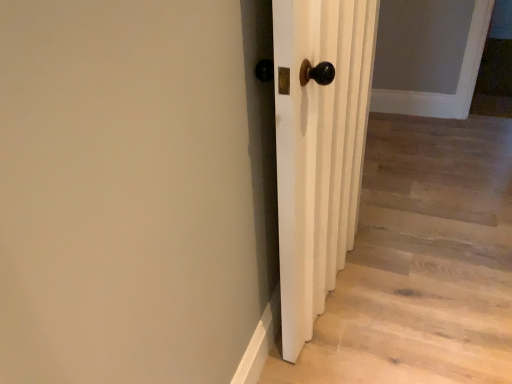
Question: Is point (349, 41) positioned closer to the camera than point (396, 334)?

Choices:
 (A) closer
 (B) farther

Answer: (A)

Question: From a real-world perspective, is white wooden door at center positioned above or below white matte door at center?

Choices:
 (A) below
 (B) above

Answer: (B)

Question: Would you say white wooden door at center is inside or outside white matte door at center?

Choices:
 (A) inside
 (B) outside

Answer: (B)

Question: Looking at the image, does white matte door at center seem bigger or smaller compared to white wooden door at center?

Choices:
 (A) small
 (B) big

Answer: (A)

Question: Choose the correct answer: Is white matte door at center inside white wooden door at center or outside it?

Choices:
 (A) outside
 (B) inside

Answer: (A)

Question: From a real-world perspective, relative to white wooden door at center, is white matte door at center vertically above or below?

Choices:
 (A) below
 (B) above

Answer: (A)

Question: From the image's perspective, is white matte door at center positioned above or below white wooden door at center?

Choices:
 (A) above
 (B) below

Answer: (B)